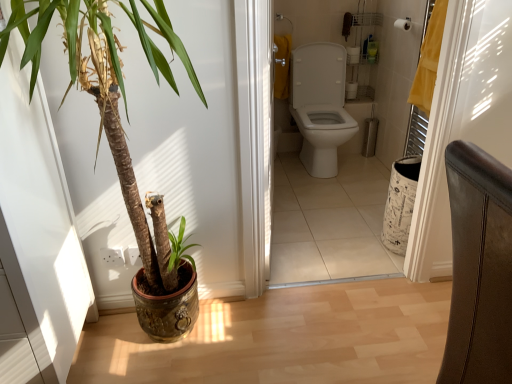
Question: Would you say white glossy toilet at center is outside green glossy plant at left?

Choices:
 (A) no
 (B) yes

Answer: (B)

Question: Can you confirm if white glossy toilet at center is positioned to the left of green glossy plant at left?

Choices:
 (A) no
 (B) yes

Answer: (A)

Question: Are white glossy toilet at center and green glossy plant at left far apart?

Choices:
 (A) yes
 (B) no

Answer: (A)

Question: Is green glossy plant at left inside white glossy toilet at center?

Choices:
 (A) no
 (B) yes

Answer: (A)

Question: Can you confirm if white glossy toilet at center is smaller than green glossy plant at left?

Choices:
 (A) yes
 (B) no

Answer: (A)

Question: Is leather-like chair at right wider or thinner than white matte toilet paper at upper center?

Choices:
 (A) wide
 (B) thin

Answer: (A)

Question: Is leather-like chair at right taller or shorter than white matte toilet paper at upper center?

Choices:
 (A) short
 (B) tall

Answer: (B)

Question: Considering the relative positions of leather-like chair at right and white matte toilet paper at upper center in the image provided, is leather-like chair at right to the left or to the right of white matte toilet paper at upper center?

Choices:
 (A) left
 (B) right

Answer: (A)

Question: Based on their sizes in the image, would you say leather-like chair at right is bigger or smaller than white matte toilet paper at upper center?

Choices:
 (A) big
 (B) small

Answer: (A)

Question: From the image's perspective, is white glossy toilet at center above or below green glossy plant at left?

Choices:
 (A) above
 (B) below

Answer: (A)

Question: Is white glossy toilet at center spatially inside green glossy plant at left, or outside of it?

Choices:
 (A) inside
 (B) outside

Answer: (B)

Question: Considering the positions of white glossy toilet at center and green glossy plant at left in the image, is white glossy toilet at center bigger or smaller than green glossy plant at left?

Choices:
 (A) big
 (B) small

Answer: (B)

Question: Is white glossy toilet at center wider or thinner than green glossy plant at left?

Choices:
 (A) thin
 (B) wide

Answer: (A)

Question: Is green glossy plant at left wider or thinner than leather-like chair at right?

Choices:
 (A) thin
 (B) wide

Answer: (B)

Question: Based on their sizes in the image, would you say green glossy plant at left is bigger or smaller than leather-like chair at right?

Choices:
 (A) big
 (B) small

Answer: (A)